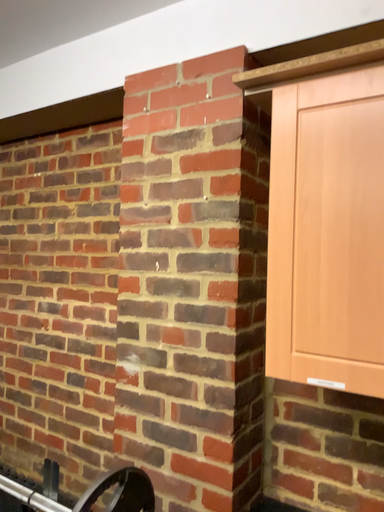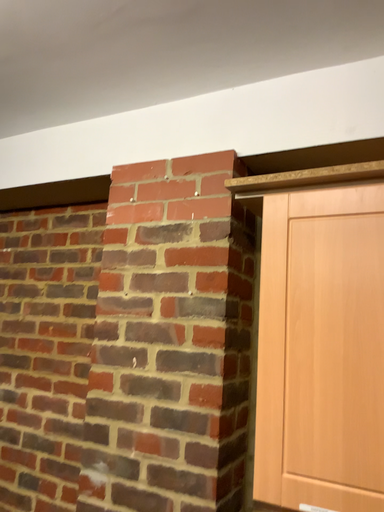
Question: Which way did the camera rotate in the video?

Choices:
 (A) rotated upward
 (B) rotated downward

Answer: (A)